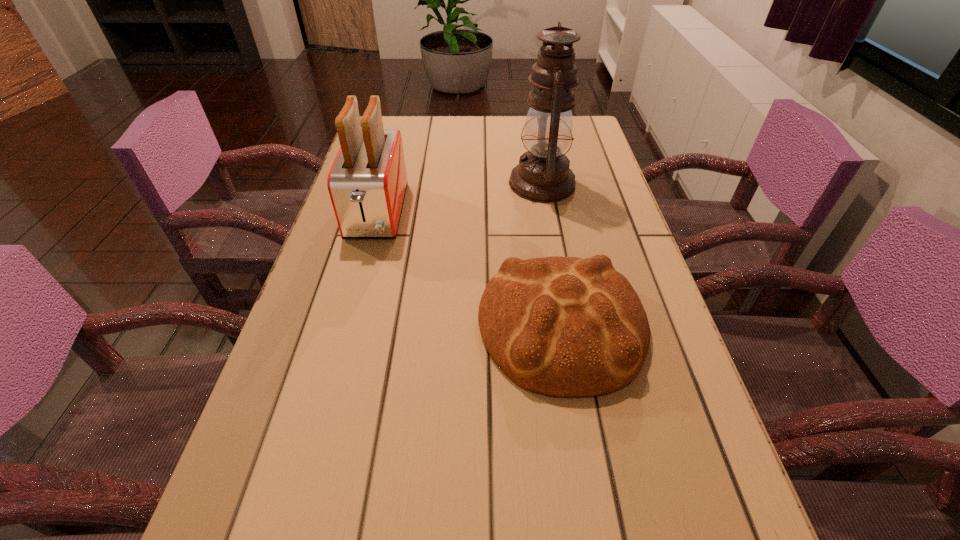
Identify the location of the tallest object. The width and height of the screenshot is (960, 540). (543, 175).

This screenshot has height=540, width=960. Identify the location of the leftmost object. (367, 183).

This screenshot has width=960, height=540. I want to click on the second tallest object, so click(367, 183).

At what (x,y) coordinates should I click in order to perform the action: click on the nearest object. Please return your answer as a coordinate pair (x, y). This screenshot has width=960, height=540. Looking at the image, I should click on (566, 327).

Identify the location of the shortest object. The width and height of the screenshot is (960, 540). (566, 327).

The width and height of the screenshot is (960, 540). I want to click on blank space located on the front of the oil lamp, so [x=560, y=281].

Locate an element on the screen. This screenshot has height=540, width=960. free point located on the front-facing side of the leftmost object is located at coordinates (348, 320).

I want to click on free spot located 0.140m on the back of the bread, so click(546, 229).

Image resolution: width=960 pixels, height=540 pixels. What are the coordinates of `object that is positioned at the left edge` in the screenshot? It's located at (367, 183).

Locate an element on the screen. This screenshot has width=960, height=540. oil lamp located at the right edge is located at coordinates (543, 175).